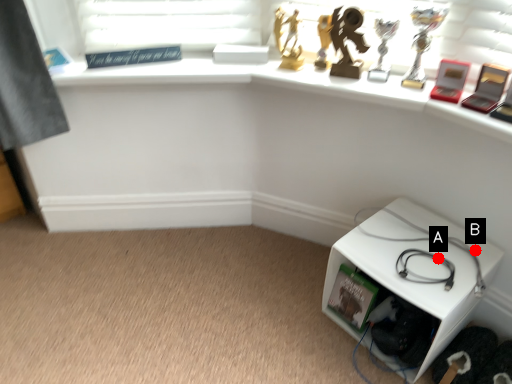
Question: Two points are circled on the image, labeled by A and B beside each circle. Among these points, which one is nearest to the camera?

Choices:
 (A) A is closer
 (B) B is closer

Answer: (A)